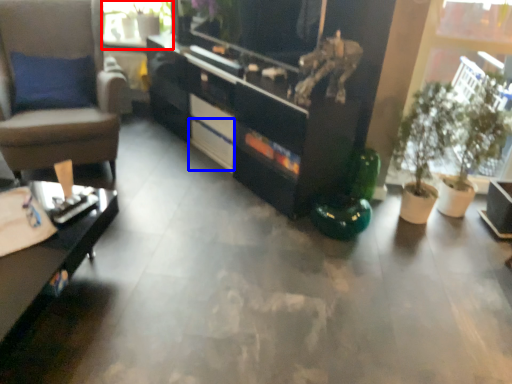
Question: Which object appears closest to the camera in this image, window screen (highlighted by a red box) or drawer (highlighted by a blue box)?

Choices:
 (A) window screen
 (B) drawer

Answer: (B)